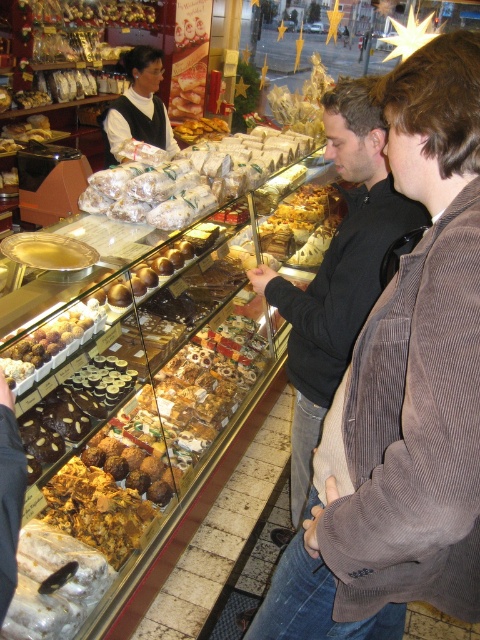
Can you confirm if black corduroy jacket at center is smaller than white paper wrapped pastries at center?

Correct, black corduroy jacket at center occupies less space than white paper wrapped pastries at center.

Can you confirm if black corduroy jacket at center is positioned to the left of white paper wrapped pastries at center?

In fact, black corduroy jacket at center is to the right of white paper wrapped pastries at center.

Find the location of a particular element. black corduroy jacket at center is located at coordinates (337, 269).

This screenshot has height=640, width=480. Describe the element at coordinates (190, 177) in the screenshot. I see `white paper wrapped pastries at center` at that location.

From the picture: Can you confirm if white paper wrapped pastries at center is positioned below matte black vest at center?

Correct, white paper wrapped pastries at center is located below matte black vest at center.

Where is `white paper wrapped pastries at center`? The width and height of the screenshot is (480, 640). white paper wrapped pastries at center is located at coordinates (190, 177).

Who is more forward, (290, 371) or (142, 140)?

Positioned in front is point (290, 371).

This screenshot has width=480, height=640. I want to click on black corduroy jacket at center, so click(x=337, y=269).